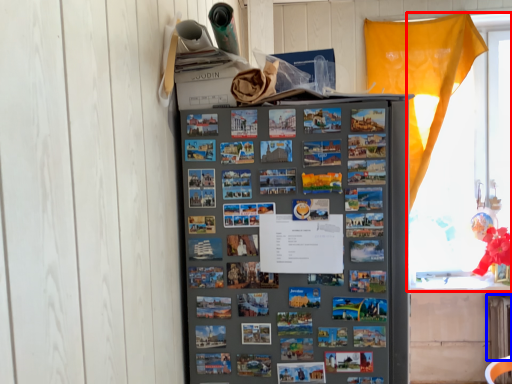
Question: Among these objects, which one is farthest to the camera, window (highlighted by a red box) or radiator (highlighted by a blue box)?

Choices:
 (A) window
 (B) radiator

Answer: (A)